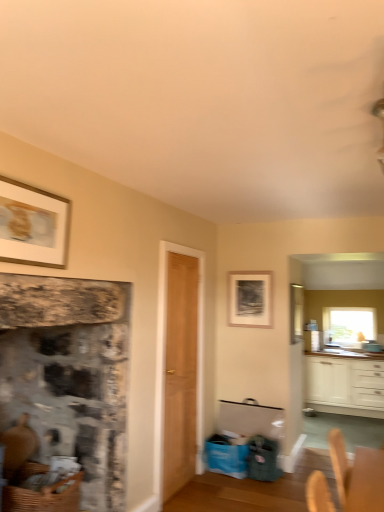
Question: Is light brown wood door at center completely or partially inside clear glass window at upper right?

Choices:
 (A) yes
 (B) no

Answer: (B)

Question: Considering the relative sizes of clear glass window at upper right and light brown wood door at center in the image provided, is clear glass window at upper right thinner than light brown wood door at center?

Choices:
 (A) yes
 (B) no

Answer: (B)

Question: From a real-world perspective, is clear glass window at upper right located higher than light brown wood door at center?

Choices:
 (A) yes
 (B) no

Answer: (A)

Question: Does clear glass window at upper right come in front of light brown wood door at center?

Choices:
 (A) yes
 (B) no

Answer: (B)

Question: Can you confirm if clear glass window at upper right is positioned to the left of light brown wood door at center?

Choices:
 (A) yes
 (B) no

Answer: (B)

Question: Is clear glass window at upper right situated inside gold-framed picture at upper left, which ranks as the first picture frame in front-to-back order, or outside?

Choices:
 (A) inside
 (B) outside

Answer: (B)

Question: Is clear glass window at upper right wider or thinner than gold-framed picture at upper left, the 1th picture frame from the top?

Choices:
 (A) wide
 (B) thin

Answer: (A)

Question: Considering the positions of point (331, 331) and point (61, 234), is point (331, 331) closer or farther from the camera than point (61, 234)?

Choices:
 (A) farther
 (B) closer

Answer: (A)

Question: Based on their sizes in the image, would you say clear glass window at upper right is bigger or smaller than gold-framed picture at upper left, the 1th picture frame from the top?

Choices:
 (A) big
 (B) small

Answer: (A)

Question: From the image's perspective, is clear glass window screen at upper right located above or below gold-framed picture at upper left, which ranks as the second picture frame in bottom-to-top order?

Choices:
 (A) above
 (B) below

Answer: (B)

Question: In terms of size, does clear glass window screen at upper right appear bigger or smaller than gold-framed picture at upper left, which ranks as the second picture frame in bottom-to-top order?

Choices:
 (A) big
 (B) small

Answer: (A)

Question: Considering the positions of clear glass window screen at upper right and gold-framed picture at upper left, which ranks as the second picture frame in back-to-front order, in the image, is clear glass window screen at upper right wider or thinner than gold-framed picture at upper left, which ranks as the second picture frame in back-to-front order,?

Choices:
 (A) thin
 (B) wide

Answer: (B)

Question: Considering their positions, is clear glass window screen at upper right located in front of or behind gold-framed picture at upper left, which ranks as the second picture frame in bottom-to-top order?

Choices:
 (A) behind
 (B) front

Answer: (A)

Question: Considering their positions, is rustic stone fireplace at left located in front of or behind matte black picture frame at center, arranged as the 1th picture frame when viewed from the back?

Choices:
 (A) front
 (B) behind

Answer: (A)

Question: Visually, is rustic stone fireplace at left positioned to the left or to the right of matte black picture frame at center, which is the 2th picture frame in top-to-bottom order?

Choices:
 (A) left
 (B) right

Answer: (A)